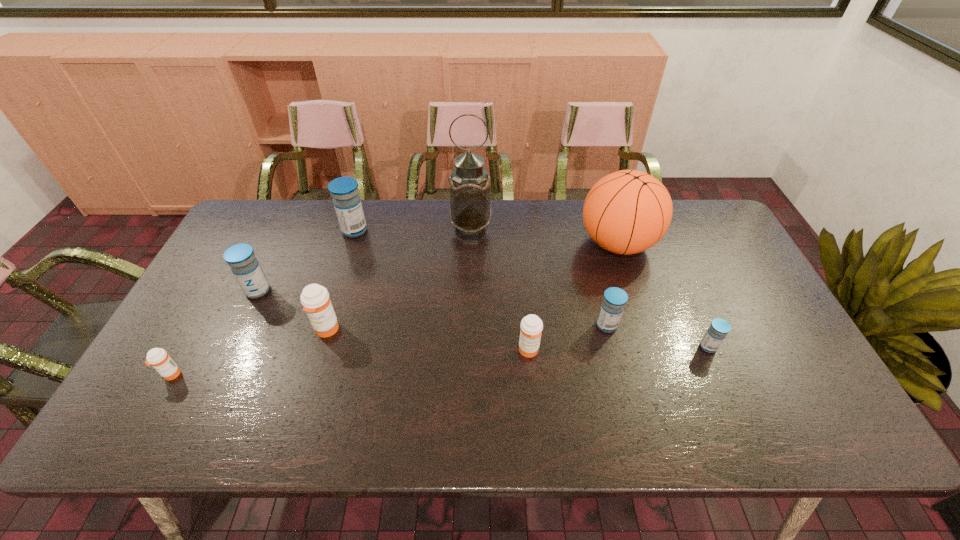
Locate an element on the screen. the sixth object from left to right is located at coordinates (531, 325).

The height and width of the screenshot is (540, 960). In order to click on the fifth medicine from left to right in this screenshot , I will do `click(531, 325)`.

Image resolution: width=960 pixels, height=540 pixels. I want to click on the nearest blue medicine, so click(719, 328).

This screenshot has height=540, width=960. I want to click on the rightmost medicine, so click(719, 328).

Find the location of a particular element. The image size is (960, 540). the nearest medicine is located at coordinates (158, 358).

This screenshot has width=960, height=540. In order to click on the smallest orange medicine in this screenshot , I will do `click(158, 358)`.

This screenshot has width=960, height=540. Find the location of `free space located on the front of the fifth object from left to right`. free space located on the front of the fifth object from left to right is located at coordinates (469, 299).

You are a GUI agent. You are given a task and a screenshot of the screen. Output one action in this format:
    pyautogui.click(x=<x>, y=<y>)
    Task: Click on the free location located 0.090m on the back of the basketball
    
    Given the screenshot: What is the action you would take?
    pyautogui.click(x=604, y=202)

The width and height of the screenshot is (960, 540). I want to click on vacant region located 0.150m on the left of the farthest blue medicine, so click(x=296, y=231).

The height and width of the screenshot is (540, 960). What are the coordinates of `vacant region located on the right of the second biggest blue medicine` in the screenshot? It's located at (353, 291).